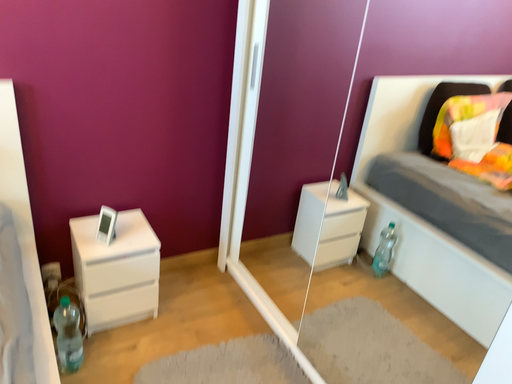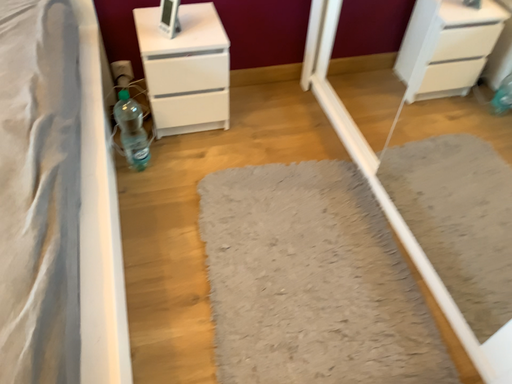
Question: How did the camera likely rotate when shooting the video?

Choices:
 (A) rotated right
 (B) rotated left

Answer: (B)